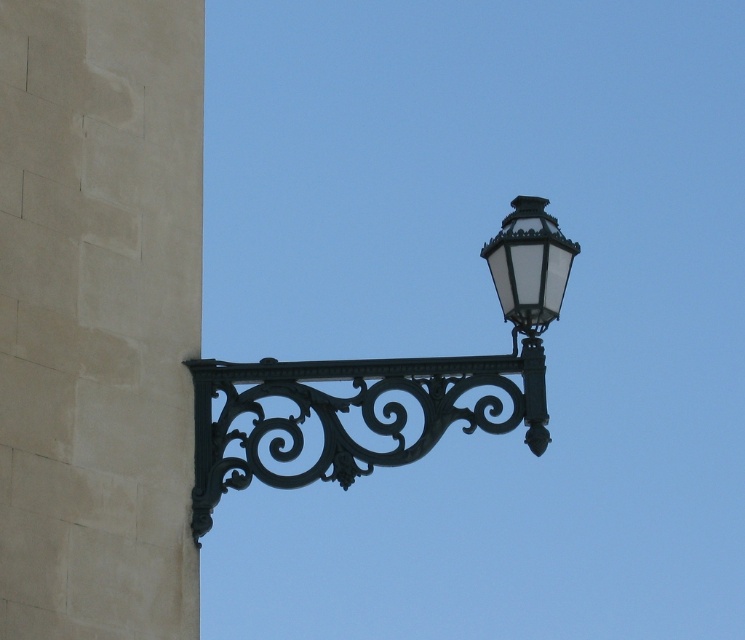
Who is more forward, (226, 369) or (548, 433)?

Point (548, 433)

Which is above, black wrought iron streetlight at upper right or matte black street light at upper right?

Positioned higher is matte black street light at upper right.

Between point (542, 224) and point (551, 289), which one is positioned in front?

Point (551, 289) is in front.

Identify the location of black wrought iron streetlight at upper right. (387, 381).